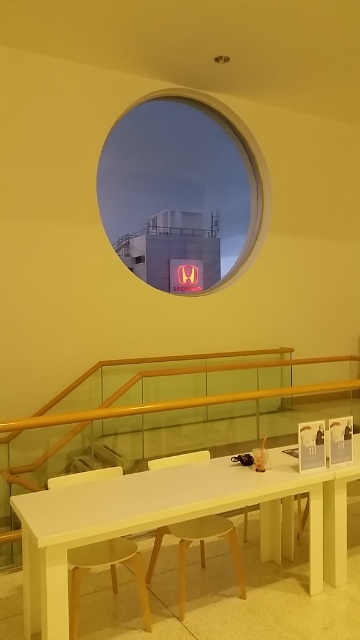
Question: Observing the image, what is the correct spatial positioning of light brown wooden stool at lower left in reference to wooden stool at center?

Choices:
 (A) above
 (B) below

Answer: (A)

Question: Is wooden polished rail at lower center bigger than white matte table at lower center?

Choices:
 (A) no
 (B) yes

Answer: (B)

Question: Does red neon sign at center appear over light brown wooden stool at lower left?

Choices:
 (A) no
 (B) yes

Answer: (B)

Question: Considering the real-world distances, which object is farthest from the light brown wooden stool at lower left?

Choices:
 (A) red neon sign at center
 (B) wooden polished rail at lower center
 (C) wooden stool at center

Answer: (A)

Question: Which point is closer to the camera taking this photo?

Choices:
 (A) (221, 376)
 (B) (321, 586)
 (C) (142, 593)
 (D) (109, 237)

Answer: (C)

Question: Which point is farther to the camera?

Choices:
 (A) wooden stool at center
 (B) white matte table at lower center

Answer: (A)